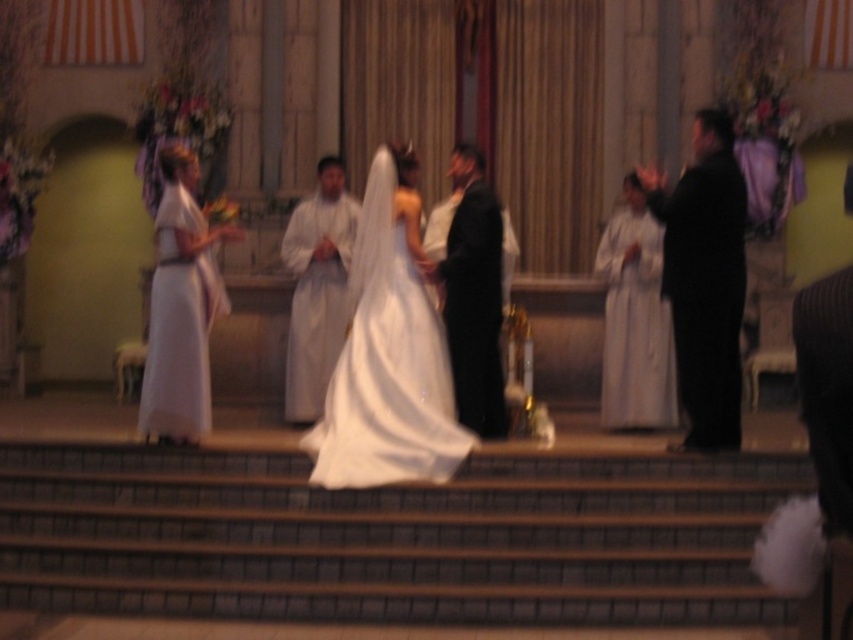
Based on the photo, you are a photographer positioned at the back of the ceremony. You need to capture a photo of both the black satin suit at right and the white satin dress at right. Considering their widths, which one might require more space in the frame to ensure it is fully visible?

The black satin suit at right has a greater width than the white satin dress at right, so it would require more space in the frame to be fully visible.

You are a photographer positioned at the back of the venue. You need to capture a clear photo of both the black satin suit at right and the white satin dress at right. Since they are both at the right side of the frame, which one is closer to you so that you can focus your camera accordingly?

The black satin suit at right is in front of the white satin dress at right, so the black satin suit at right is closer to you and should be the focus point for your camera.

You are a photographer capturing the wedding ceremony. You notice the white satin dress at right and the white matte robe at center. Which one appears shorter in the image?

The white satin dress at right has a lesser height compared to the white matte robe at center, so the white satin dress at right appears shorter in the image.